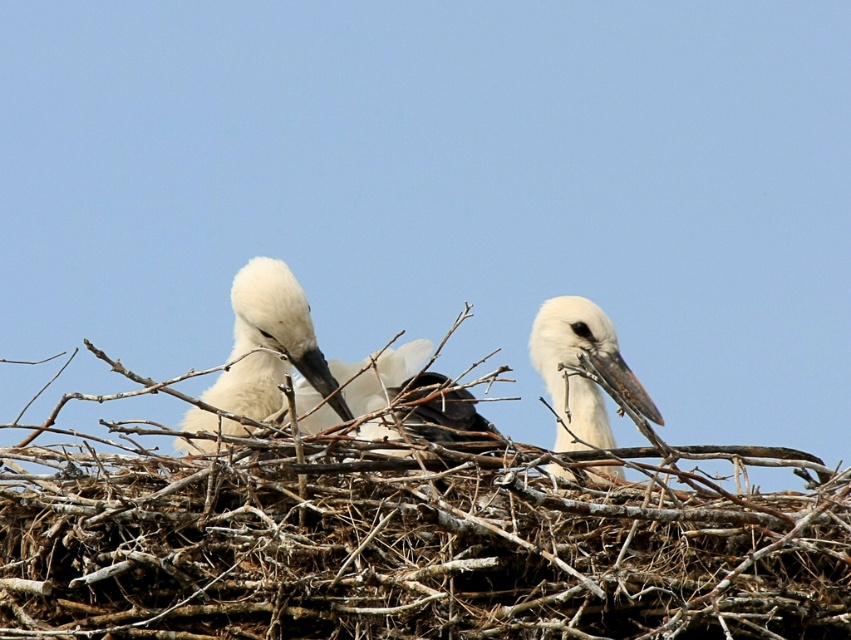
Question: Is white matte bird at center behind white matte stork at right?

Choices:
 (A) no
 (B) yes

Answer: (B)

Question: Does white matte bird at center come in front of white matte stork at right?

Choices:
 (A) yes
 (B) no

Answer: (B)

Question: Which object appears closest to the camera in this image?

Choices:
 (A) white matte bird at center
 (B) white matte stork at right

Answer: (B)

Question: Does white matte bird at center have a lesser width compared to white matte stork at right?

Choices:
 (A) no
 (B) yes

Answer: (A)